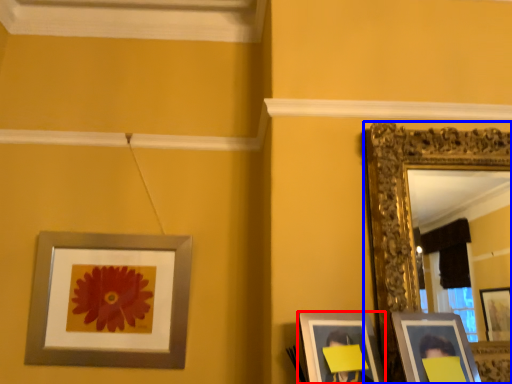
Question: Which of the following is the farthest to the observer, picture frame (highlighted by a red box) or picture frame (highlighted by a blue box)?

Choices:
 (A) picture frame
 (B) picture frame

Answer: (B)